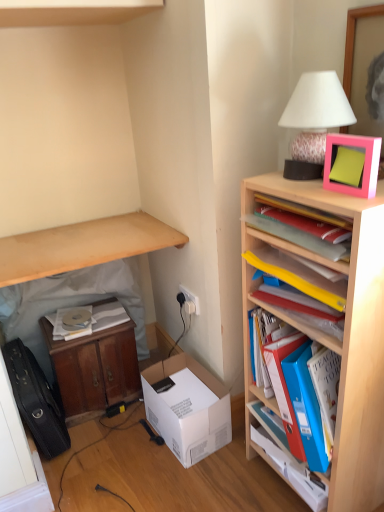
Locate an element on the screen. vacant space situated on the left part of white cardboard box at lower center is located at coordinates (125, 449).